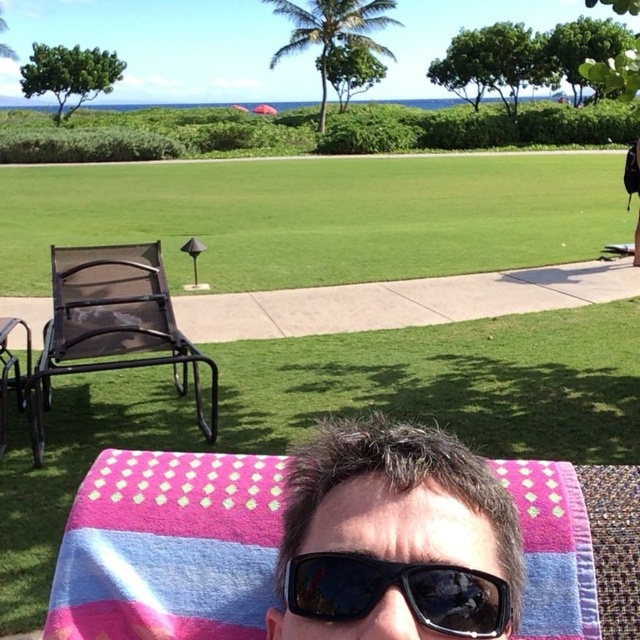
Is black matte sunglasses at center smaller than black reflective sunglasses at center?

Actually, black matte sunglasses at center might be larger than black reflective sunglasses at center.

Is point (419, 541) closer to viewer compared to point (301, 588)?

Yes, it is in front of point (301, 588).

Who is more forward, (378,518) or (417,580)?

Point (417,580) is more forward.

The image size is (640, 640). Find the location of `black matte sunglasses at center`. black matte sunglasses at center is located at coordinates (394, 532).

Does pink woven towel at lower center have a greater width compared to matte black lounge chair at left?

No, pink woven towel at lower center is not wider than matte black lounge chair at left.

Can you confirm if pink woven towel at lower center is positioned above matte black lounge chair at left?

No.

Is point (100, 605) positioned after point (99, 349)?

That is False.

Identify the location of pink woven towel at lower center. (168, 547).

Does black matte sunglasses at center appear under black mesh chair at left?

Actually, black matte sunglasses at center is above black mesh chair at left.

Looking at this image, who is positioned more to the left, black matte sunglasses at center or black mesh chair at left?

black mesh chair at left

Find the location of a particular element. black matte sunglasses at center is located at coordinates (394, 532).